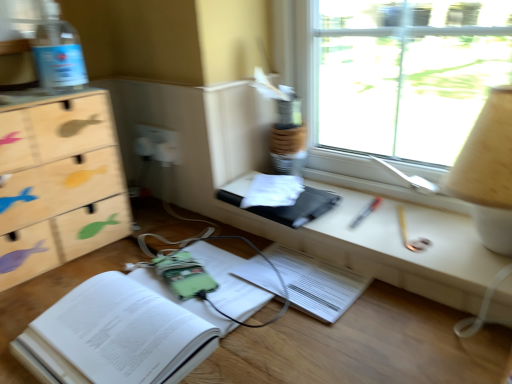
Find the location of a particular element. This screenshot has height=384, width=512. free spot to the right of green fabric book at lower left, positioned as the 1th paperback book in bottom-to-top order is located at coordinates (325, 317).